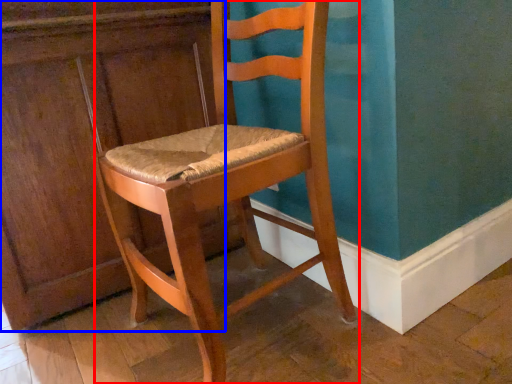
Question: Which object is closer to the camera taking this photo, chair (highlighted by a red box) or dresser (highlighted by a blue box)?

Choices:
 (A) chair
 (B) dresser

Answer: (A)